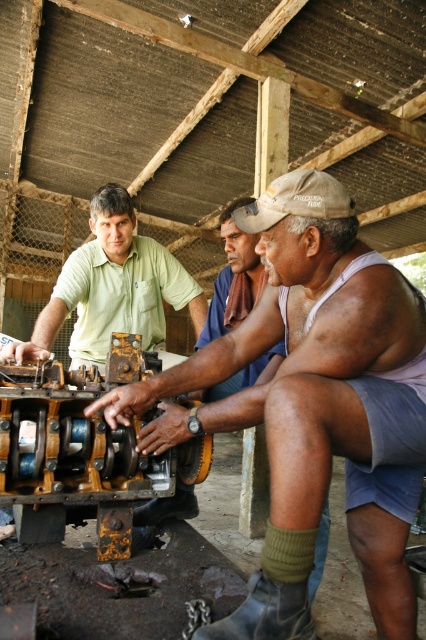
Which is behind, point (104, 298) or point (271, 355)?

The point (104, 298) is more distant.

Can you confirm if green matte shirt at center is bigger than brown fabric shirt at center?

Yes, green matte shirt at center is bigger than brown fabric shirt at center.

Between point (123, 225) and point (235, 202), which one is positioned behind?

The point (123, 225) is behind.

The height and width of the screenshot is (640, 426). I want to click on green matte shirt at center, so click(112, 289).

Does point (264, 193) come in front of point (94, 307)?

Yes.

Does matte black machine at center have a lesser width compared to green matte shirt at center?

No, matte black machine at center is not thinner than green matte shirt at center.

Is point (370, 529) closer to viewer compared to point (92, 211)?

Yes, point (370, 529) is closer to viewer.

At what (x,y) coordinates should I click in order to perform the action: click on matte black machine at center. Please return your answer as a coordinate pair (x, y). This screenshot has width=426, height=640. Looking at the image, I should click on (302, 384).

Which is more to the right, matte black machine at center or brown fabric shirt at center?

From the viewer's perspective, matte black machine at center appears more on the right side.

Where is `matte black machine at center`? matte black machine at center is located at coordinates (302, 384).

You are a GUI agent. You are given a task and a screenshot of the screen. Output one action in this format:
    pyautogui.click(x=<x>, y=<y>)
    Task: Click on the matte black machine at center
    
    Given the screenshot: What is the action you would take?
    pyautogui.click(x=302, y=384)